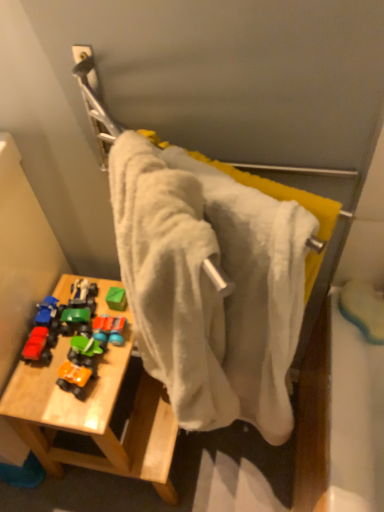
Locate an element on the screen. This screenshot has height=512, width=384. vacant point to the left of orange matte toy car at lower left, which is counted as the third toy, starting from the left is located at coordinates tap(39, 385).